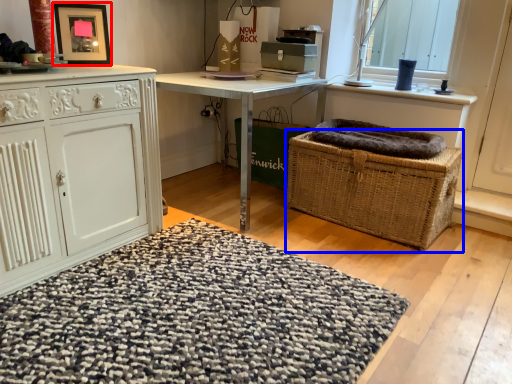
Question: Which object appears closest to the camera in this image, picture frame (highlighted by a red box) or picnic basket (highlighted by a blue box)?

Choices:
 (A) picture frame
 (B) picnic basket

Answer: (A)